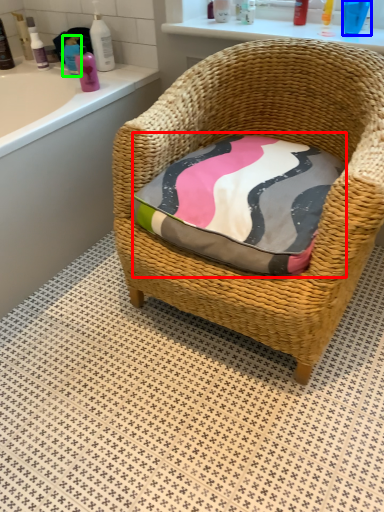
Question: Considering the real-world distances, which object is closest to throw pillow (highlighted by a red box)? toiletry (highlighted by a blue box) or toiletry (highlighted by a green box).

Choices:
 (A) toiletry
 (B) toiletry

Answer: (A)